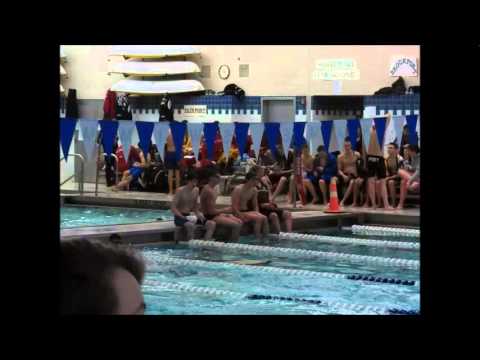
I want to click on handrail, so click(x=117, y=162), click(x=81, y=165).